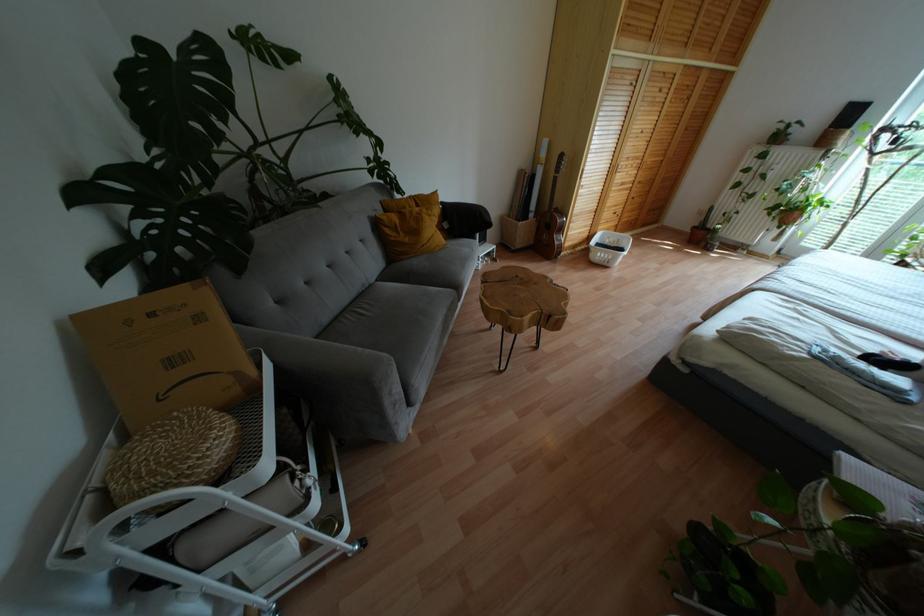
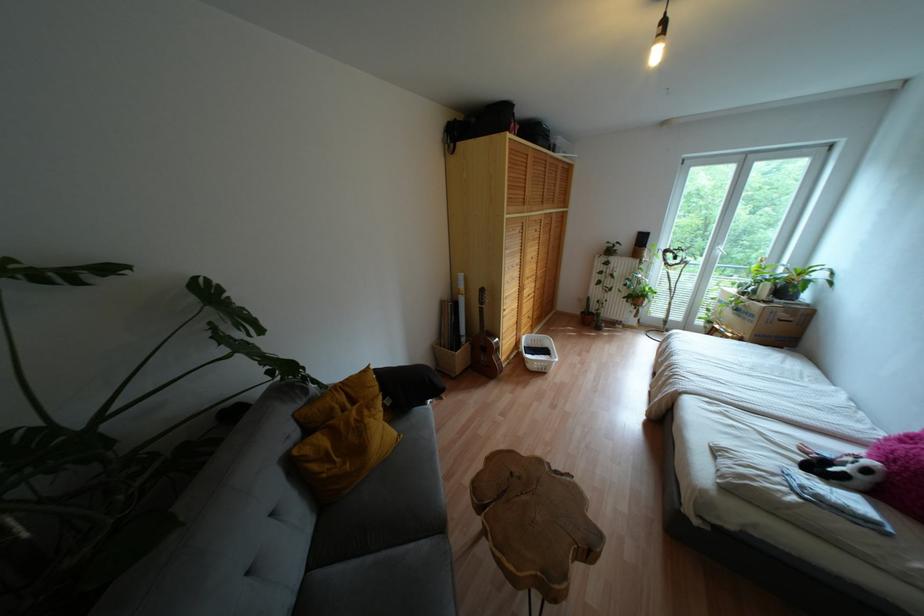
Question: The camera is either moving clockwise (left) or counter-clockwise (right) around the object. The first image is from the beginning of the video and the second image is from the end. Is the camera moving left or right when shooting the video?

Choices:
 (A) Left
 (B) Right

Answer: (A)